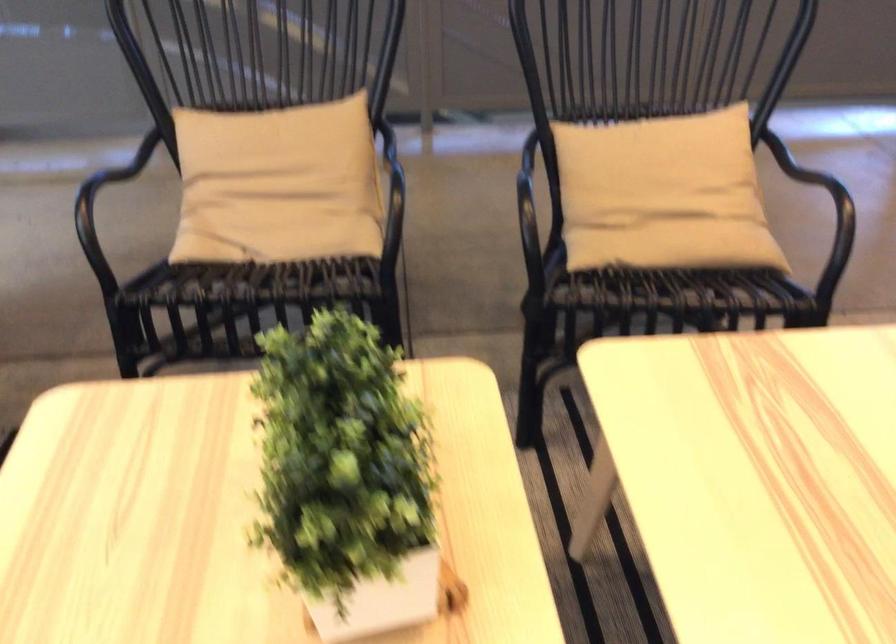
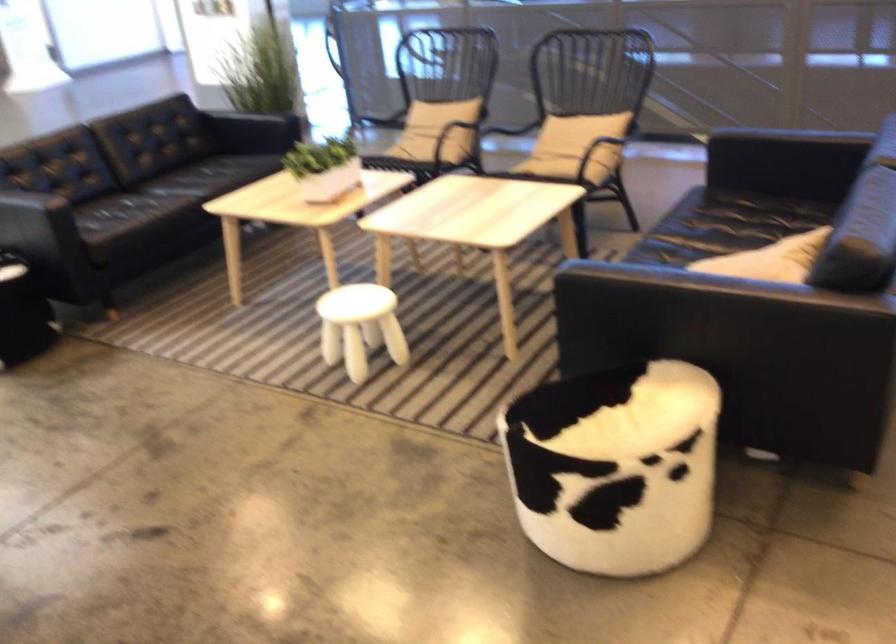
In the second image, find the point that corresponds to [389,205] in the first image.

(450, 135)